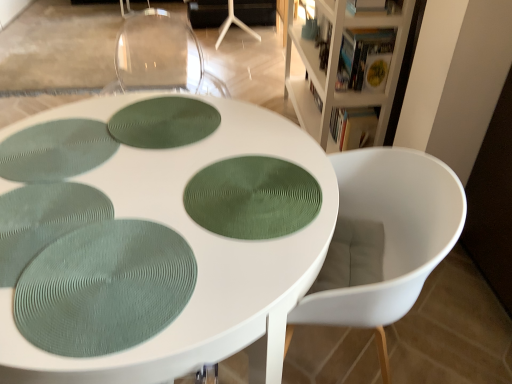
Where is `free space underneath green textured placemat at center, arranged as the 3th oval when ordered from the bottom (from a real-world perspective)`? This screenshot has width=512, height=384. free space underneath green textured placemat at center, arranged as the 3th oval when ordered from the bottom (from a real-world perspective) is located at coordinates (165, 125).